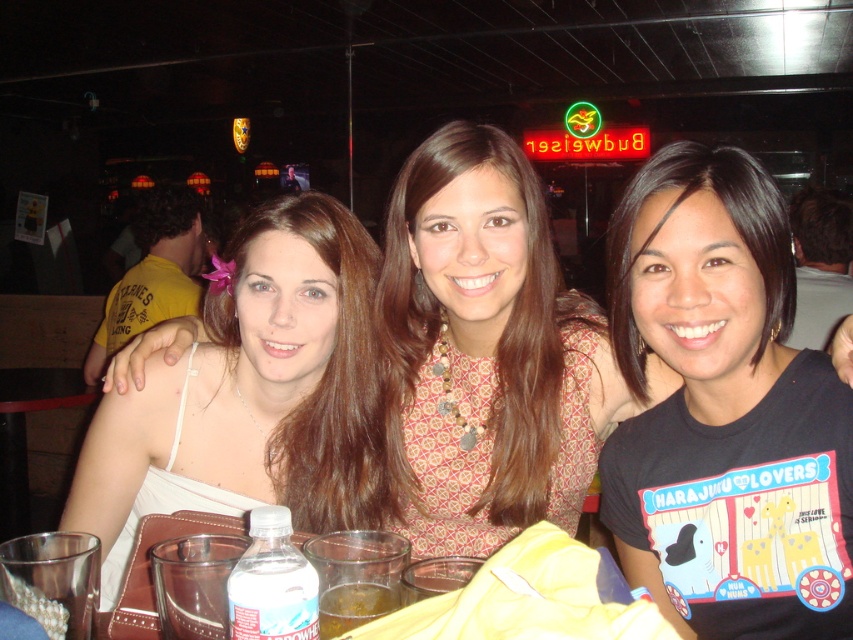
Between point (183, 403) and point (531, 500), which one is positioned behind?

Point (183, 403)

Does point (271, 420) lie behind point (521, 291)?

Yes, point (271, 420) is farther from viewer.

At what (x,y) coordinates should I click in order to perform the action: click on white fabric dress at center. Please return your answer as a coordinate pair (x, y). Image resolution: width=853 pixels, height=640 pixels. Looking at the image, I should click on (x=248, y=392).

Is brown hair at center in front of translucent plastic cup at lower center?

That is False.

Can you confirm if brown hair at center is taller than translucent plastic cup at lower center?

Indeed, brown hair at center has a greater height compared to translucent plastic cup at lower center.

Between point (798, 240) and point (401, 604), which one is positioned in front?

Positioned in front is point (401, 604).

You are a GUI agent. You are given a task and a screenshot of the screen. Output one action in this format:
    pyautogui.click(x=<x>, y=<y>)
    Task: Click on the brown hair at center
    
    Given the screenshot: What is the action you would take?
    pyautogui.click(x=822, y=227)

Based on the photo, does matte white dress at center have a lesser height compared to white fabric dress at center?

No, matte white dress at center is not shorter than white fabric dress at center.

Is matte white dress at center above white fabric dress at center?

Correct, matte white dress at center is located above white fabric dress at center.

Between point (422, 416) and point (264, 285), which one is positioned behind?

The point (422, 416) is behind.

Where is `matte white dress at center`? matte white dress at center is located at coordinates (489, 353).